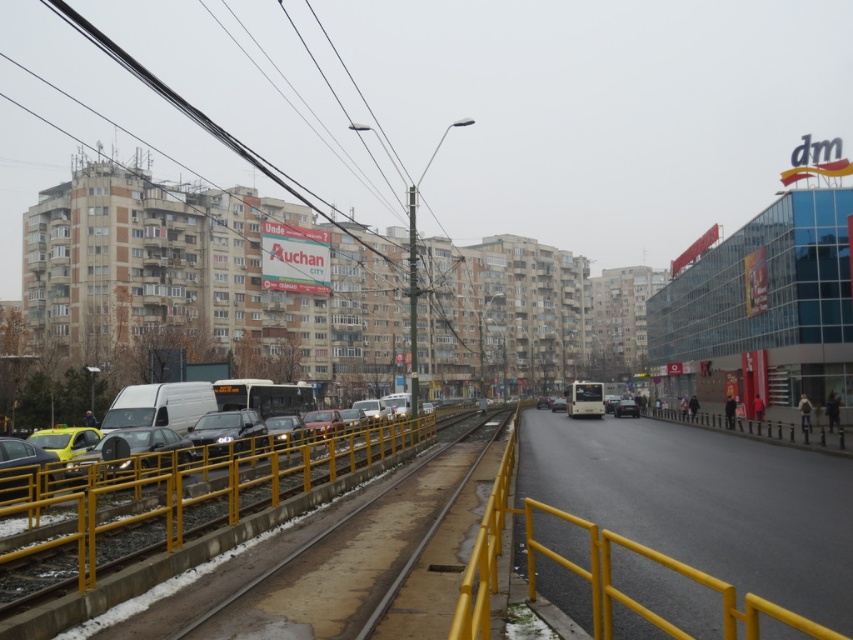
Can you confirm if black wire at upper left is taller than dark gray metallic car at center?

Indeed, black wire at upper left has a greater height compared to dark gray metallic car at center.

Where is `black wire at upper left`? The width and height of the screenshot is (853, 640). black wire at upper left is located at coordinates (219, 273).

Who is more distant from viewer, (96, 275) or (463, 433)?

Positioned behind is point (96, 275).

Is black wire at upper left taller than yellow metal train track at center?

Yes.

The image size is (853, 640). Describe the element at coordinates (219, 273) in the screenshot. I see `black wire at upper left` at that location.

This screenshot has width=853, height=640. Identify the location of black wire at upper left. (219, 273).

This screenshot has height=640, width=853. What do you see at coordinates (207, 458) in the screenshot? I see `matte white van at center-left` at bounding box center [207, 458].

Does point (97, 458) lie in front of point (212, 611)?

That is False.

Locate an element on the screen. This screenshot has height=640, width=853. matte white van at center-left is located at coordinates (207, 458).